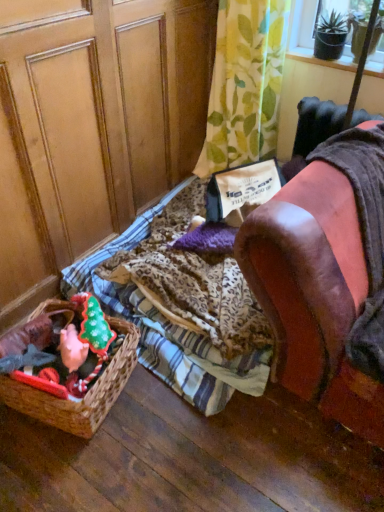
Measure the distance between brown woven basket at lower left and camera.

brown woven basket at lower left and camera are 4.14 feet apart.

Locate an element on the screen. green leafy fabric at upper center is located at coordinates (245, 84).

Describe the element at coordinates (245, 84) in the screenshot. This screenshot has width=384, height=512. I see `green leafy fabric at upper center` at that location.

At what (x,y) coordinates should I click in order to perform the action: click on wooden screen door at left. Please return your answer as a coordinate pair (x, y). This screenshot has height=512, width=384. Looking at the image, I should click on (92, 126).

The height and width of the screenshot is (512, 384). What are the coordinates of `screen door that appears below the transparent plastic screen at upper right (from a real-world perspective)` in the screenshot? It's located at tap(92, 126).

In the scene shown: Is wooden screen door at left with transparent plastic screen at upper right?

No.

In the image, is wooden screen door at left positioned in front of or behind transparent plastic screen at upper right?

Clearly, wooden screen door at left is in front of transparent plastic screen at upper right.

Considering the sizes of objects wooden screen door at left and transparent plastic screen at upper right in the image provided, who is shorter, wooden screen door at left or transparent plastic screen at upper right?

Standing shorter between the two is transparent plastic screen at upper right.

Which is closer, (223,144) or (66,418)?

Point (223,144) is positioned farther from the camera compared to point (66,418).

Would you say green leafy fabric at upper center contains brown woven basket at lower left?

That's incorrect, brown woven basket at lower left is not inside green leafy fabric at upper center.

Which of these two, green leafy fabric at upper center or brown woven basket at lower left, is smaller?

With smaller size is brown woven basket at lower left.

Is brown woven basket at lower left at the back of green leafy fabric at upper center?

That's not correct — green leafy fabric at upper center is not looking away from brown woven basket at lower left.

Is wooden screen door at left not near green leafy fabric at upper center?

wooden screen door at left is near green leafy fabric at upper center, not far away.

From a real-world perspective, between wooden screen door at left and green leafy fabric at upper center, who is vertically lower?

green leafy fabric at upper center is physically lower.

Is wooden screen door at left oriented away from green leafy fabric at upper center?

That's not correct — wooden screen door at left is not looking away from green leafy fabric at upper center.

Between transparent plastic screen at upper right and leather armchair at right, which one has smaller width?

transparent plastic screen at upper right is thinner.

Can you confirm if transparent plastic screen at upper right is positioned to the right of leather armchair at right?

Correct, you'll find transparent plastic screen at upper right to the right of leather armchair at right.

From the image's perspective, is transparent plastic screen at upper right above leather armchair at right?

Yes.

Does transparent plastic screen at upper right have a smaller size compared to leather armchair at right?

Indeed, transparent plastic screen at upper right has a smaller size compared to leather armchair at right.

Is brown woven basket at lower left not within green leafy fabric at upper center?

That's correct, brown woven basket at lower left is outside of green leafy fabric at upper center.

Find the location of a particular element. gift basket in front of the green leafy fabric at upper center is located at coordinates (84, 396).

Is brown woven basket at lower left taller than green leafy fabric at upper center?

No, brown woven basket at lower left is not taller than green leafy fabric at upper center.

Based on the photo, considering the positions of objects brown woven basket at lower left and green leafy fabric at upper center in the image provided, who is more to the right, brown woven basket at lower left or green leafy fabric at upper center?

From the viewer's perspective, green leafy fabric at upper center appears more on the right side.

Would you say brown woven basket at lower left is to the left or to the right of leather armchair at right in the picture?

brown woven basket at lower left is positioned on leather armchair at right's left side.

Is brown woven basket at lower left bigger than leather armchair at right?

No.

Does point (44, 393) come farther from viewer compared to point (287, 186)?

No, it is in front of (287, 186).

Identify the location of gift basket that is behind the leather armchair at right. The width and height of the screenshot is (384, 512). (84, 396).

Does wooden screen door at left have a smaller size compared to leopard print fabric at center?

No.

Between wooden screen door at left and leopard print fabric at center, which one has less height?

leopard print fabric at center.

Locate an element on the screen. This screenshot has height=512, width=384. screen door located below the transparent plastic screen at upper right (from the image's perspective) is located at coordinates (92, 126).

This screenshot has height=512, width=384. In order to click on curtain above the brown woven basket at lower left (from the image's perspective) in this screenshot , I will do click(245, 84).

In the scene shown: When comparing their distances from leopard print fabric at center, does wooden screen door at left or transparent plastic screen at upper right seem closer?

wooden screen door at left is positioned closer to the anchor leopard print fabric at center.

Based on the photo, based on their spatial positions, is leather armchair at right or leopard print fabric at center closer to wooden screen door at left?

leopard print fabric at center is closer to wooden screen door at left.

Considering their positions, is leather armchair at right positioned further to brown woven basket at lower left than green leafy fabric at upper center?

green leafy fabric at upper center lies further to brown woven basket at lower left than the other object.

Considering their positions, is brown woven basket at lower left positioned closer to transparent plastic screen at upper right than green leafy fabric at upper center?

green leafy fabric at upper center.

In the scene shown: Which object lies further to the anchor point wooden screen door at left, green leafy fabric at upper center or leopard print fabric at center?

Based on the image, leopard print fabric at center appears to be further to wooden screen door at left.

Which object lies further to the anchor point leopard print fabric at center, transparent plastic screen at upper right or brown woven basket at lower left?

The object further to leopard print fabric at center is transparent plastic screen at upper right.

In the scene shown: When comparing their distances from transparent plastic screen at upper right, does wooden screen door at left or brown woven basket at lower left seem further?

brown woven basket at lower left is positioned further to the anchor transparent plastic screen at upper right.

Estimate the real-world distances between objects in this image. Which object is closer to leopard print fabric at center, green leafy fabric at upper center or brown woven basket at lower left?

brown woven basket at lower left lies closer to leopard print fabric at center than the other object.

The image size is (384, 512). Identify the location of blanket between green leafy fabric at upper center and leather armchair at right in the vertical direction. (192, 281).

At what (x,y) coordinates should I click in order to perform the action: click on screen door between green leafy fabric at upper center and leopard print fabric at center from top to bottom. Please return your answer as a coordinate pair (x, y). Image resolution: width=384 pixels, height=512 pixels. Looking at the image, I should click on (92, 126).

Find the location of a particular element. Image resolution: width=384 pixels, height=512 pixels. blanket between wooden screen door at left and leather armchair at right is located at coordinates (192, 281).

This screenshot has height=512, width=384. I want to click on curtain between transparent plastic screen at upper right and leather armchair at right in the vertical direction, so pyautogui.click(x=245, y=84).